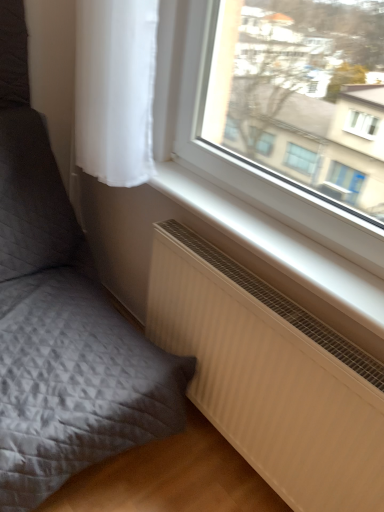
What do you see at coordinates (61, 319) in the screenshot?
I see `matte gray cushion at lower left` at bounding box center [61, 319].

Find the location of `white sheer curtain at upper left`. white sheer curtain at upper left is located at coordinates (115, 89).

The image size is (384, 512). What do you see at coordinates (115, 89) in the screenshot? I see `white sheer curtain at upper left` at bounding box center [115, 89].

What are the coordinates of `white matte window sill at lower center` in the screenshot? It's located at (278, 245).

This screenshot has width=384, height=512. What are the coordinates of `window sill lying on the right of white ribbed radiator at lower right` in the screenshot? It's located at 278,245.

Is white ribbed radiator at lower right inside the boundaries of white matte window sill at lower center, or outside?

white ribbed radiator at lower right lies outside white matte window sill at lower center.

Can you confirm if white ribbed radiator at lower right is wider than white matte window sill at lower center?

In fact, white ribbed radiator at lower right might be narrower than white matte window sill at lower center.

Is white ribbed radiator at lower right shorter than white matte window sill at lower center?

Incorrect, the height of white ribbed radiator at lower right does not fall short of that of white matte window sill at lower center.

From the image's perspective, which one is positioned lower, white sheer curtain at upper left or matte gray cushion at lower left?

matte gray cushion at lower left.

Identify the location of furniture below the white sheer curtain at upper left (from the image's perspective). (61, 319).

Is white sheer curtain at upper left wider than matte gray cushion at lower left?

In fact, white sheer curtain at upper left might be narrower than matte gray cushion at lower left.

Can you tell me how much white ribbed radiator at lower right and white sheer curtain at upper left differ in facing direction?

The angular difference between white ribbed radiator at lower right and white sheer curtain at upper left is 1.9 degrees.

I want to click on curtain behind the white ribbed radiator at lower right, so click(x=115, y=89).

Which object is wider, white ribbed radiator at lower right or white sheer curtain at upper left?

white sheer curtain at upper left is wider.

Based on the photo, is white ribbed radiator at lower right looking in the opposite direction of white sheer curtain at upper left?

No.

How different are the orientations of white ribbed radiator at lower right and matte gray cushion at lower left in degrees?

90.8 degrees.

How distant is white ribbed radiator at lower right from matte gray cushion at lower left?

white ribbed radiator at lower right is 15.11 inches from matte gray cushion at lower left.

Based on the photo, is white ribbed radiator at lower right looking in the opposite direction of matte gray cushion at lower left?

No, matte gray cushion at lower left is not at the back of white ribbed radiator at lower right.

Would you say white ribbed radiator at lower right contains matte gray cushion at lower left?

No, white ribbed radiator at lower right does not contain matte gray cushion at lower left.

Are matte gray cushion at lower left and white ribbed radiator at lower right located far from each other?

Actually, matte gray cushion at lower left and white ribbed radiator at lower right are a little close together.

Which object is further away from the camera, matte gray cushion at lower left or white ribbed radiator at lower right?

white ribbed radiator at lower right is further from the camera.

Could white ribbed radiator at lower right be considered to be inside white sheer curtain at upper left?

No, white ribbed radiator at lower right is located outside of white sheer curtain at upper left.

Is white sheer curtain at upper left looking in the opposite direction of white ribbed radiator at lower right?

No, white sheer curtain at upper left is not facing the opposite direction of white ribbed radiator at lower right.

Image resolution: width=384 pixels, height=512 pixels. In order to click on radiator that appears on the right of white sheer curtain at upper left in this screenshot , I will do `click(270, 376)`.

Which is behind, point (84, 112) or point (347, 453)?

The point (84, 112) is more distant.

Considering the relative sizes of white sheer curtain at upper left and white matte window sill at lower center in the image provided, is white sheer curtain at upper left taller than white matte window sill at lower center?

Indeed, white sheer curtain at upper left has a greater height compared to white matte window sill at lower center.

From a real-world perspective, is white sheer curtain at upper left below white matte window sill at lower center?

No.

Between white sheer curtain at upper left and white matte window sill at lower center, which one is positioned in front?

white matte window sill at lower center.

Which is more to the left, white sheer curtain at upper left or white matte window sill at lower center?

From the viewer's perspective, white sheer curtain at upper left appears more on the left side.

The width and height of the screenshot is (384, 512). Identify the location of window sill behind the white ribbed radiator at lower right. tap(278, 245).

Identify the location of curtain above the matte gray cushion at lower left (from a real-world perspective). pyautogui.click(x=115, y=89).

Considering their positions, is white sheer curtain at upper left positioned closer to matte gray cushion at lower left than white ribbed radiator at lower right?

white ribbed radiator at lower right is positioned closer to the anchor matte gray cushion at lower left.

Considering their positions, is white sheer curtain at upper left positioned closer to white ribbed radiator at lower right than white matte window sill at lower center?

→ The object closer to white ribbed radiator at lower right is white matte window sill at lower center.

Which object lies further to the anchor point white ribbed radiator at lower right, matte gray cushion at lower left or white sheer curtain at upper left?

white sheer curtain at upper left is further to white ribbed radiator at lower right.

Which object lies further to the anchor point white sheer curtain at upper left, white matte window sill at lower center or white ribbed radiator at lower right?

white ribbed radiator at lower right lies further to white sheer curtain at upper left than the other object.

Looking at the image, which one is located closer to white sheer curtain at upper left, matte gray cushion at lower left or white matte window sill at lower center?

Among the two, white matte window sill at lower center is located nearer to white sheer curtain at upper left.

When comparing their distances from white matte window sill at lower center, does white ribbed radiator at lower right or matte gray cushion at lower left seem closer?

Based on the image, white ribbed radiator at lower right appears to be nearer to white matte window sill at lower center.

Looking at the image, which one is located further to white ribbed radiator at lower right, matte gray cushion at lower left or white matte window sill at lower center?

Among the two, matte gray cushion at lower left is located further to white ribbed radiator at lower right.

Based on their spatial positions, is white ribbed radiator at lower right or matte gray cushion at lower left closer to white sheer curtain at upper left?

Based on the image, matte gray cushion at lower left appears to be nearer to white sheer curtain at upper left.

Where is `radiator between matte gray cushion at lower left and white matte window sill at lower center in the horizontal direction`? The width and height of the screenshot is (384, 512). radiator between matte gray cushion at lower left and white matte window sill at lower center in the horizontal direction is located at coordinates (270, 376).

The height and width of the screenshot is (512, 384). I want to click on window sill that lies between white sheer curtain at upper left and white ribbed radiator at lower right from top to bottom, so click(x=278, y=245).

Identify the location of curtain between matte gray cushion at lower left and white matte window sill at lower center in the horizontal direction. The height and width of the screenshot is (512, 384). (115, 89).

The image size is (384, 512). What are the coordinates of `furniture that lies between white sheer curtain at upper left and white ribbed radiator at lower right from top to bottom` in the screenshot? It's located at (61, 319).